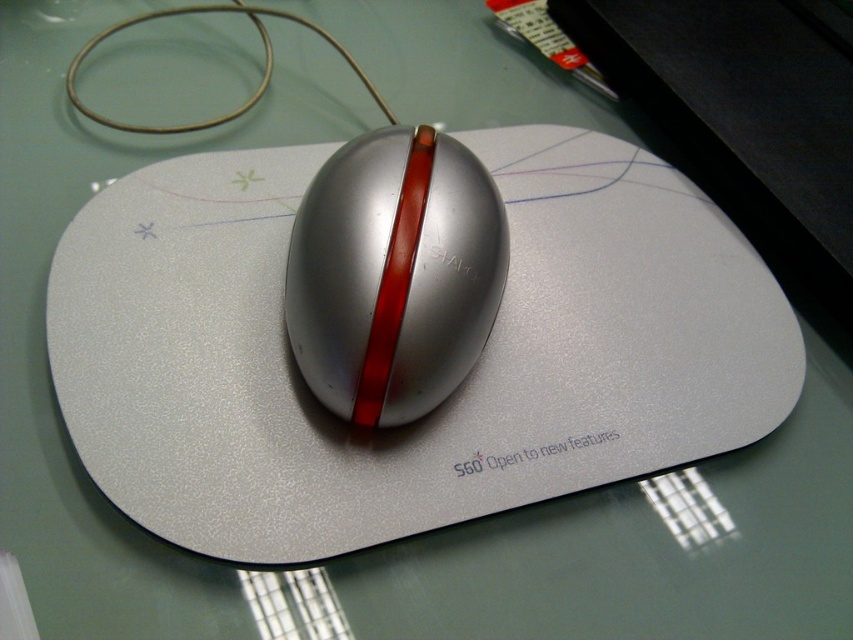
Question: Is silver textured mousepad at center smaller than metallic silver mouse at center?

Choices:
 (A) yes
 (B) no

Answer: (B)

Question: Which point is closer to the camera taking this photo?

Choices:
 (A) (438, 134)
 (B) (369, 524)

Answer: (B)

Question: Does silver textured mousepad at center appear under metallic silver mouse at center?

Choices:
 (A) yes
 (B) no

Answer: (A)

Question: Is silver textured mousepad at center to the right of metallic silver mouse at center from the viewer's perspective?

Choices:
 (A) no
 (B) yes

Answer: (B)

Question: Which point is closer to the camera?

Choices:
 (A) (398, 326)
 (B) (717, 346)

Answer: (A)